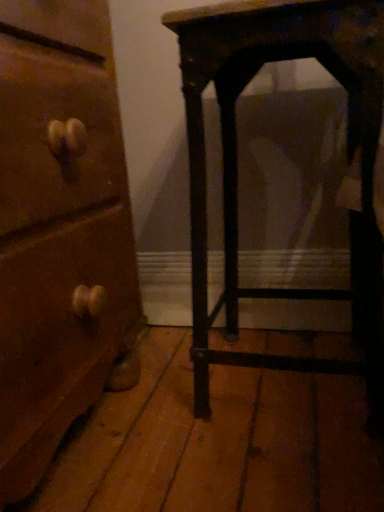
This screenshot has height=512, width=384. Describe the element at coordinates (60, 232) in the screenshot. I see `wooden chest of drawers at left` at that location.

In order to face wooden chest of drawers at left, should I rotate leftwards or rightwards?

To align with it, rotate left about 25.650°.

Locate an element on the screen. wooden chest of drawers at left is located at coordinates (60, 232).

Locate an element on the screen. The image size is (384, 512). dark wood table at right is located at coordinates (237, 160).

Measure the distance between point (276, 25) and camera.

Point (276, 25) and camera are 25.31 inches apart.

This screenshot has height=512, width=384. Describe the element at coordinates (237, 160) in the screenshot. I see `dark wood table at right` at that location.

You are a GUI agent. You are given a task and a screenshot of the screen. Output one action in this format:
    pyautogui.click(x=<x>, y=<y>)
    Task: Click on the wooden chest of drawers at left
    Image resolution: width=384 pixels, height=512 pixels.
    Given the screenshot: What is the action you would take?
    pyautogui.click(x=60, y=232)

Is wooden chest of drawers at left to the right of dark wood table at right from the viewer's perspective?

Incorrect, wooden chest of drawers at left is not on the right side of dark wood table at right.

Is wooden chest of drawers at left closer to the viewer compared to dark wood table at right?

Yes, wooden chest of drawers at left is closer to the camera.

Is point (49, 324) closer or farther from the camera than point (222, 118)?

Point (49, 324).

From the image's perspective, which is above, wooden chest of drawers at left or dark wood table at right?

dark wood table at right.

From a real-world perspective, is wooden chest of drawers at left located beneath dark wood table at right?

No, from a real-world perspective, wooden chest of drawers at left is not below dark wood table at right.

In terms of width, does wooden chest of drawers at left look wider or thinner when compared to dark wood table at right?

Clearly, wooden chest of drawers at left has more width compared to dark wood table at right.

Is wooden chest of drawers at left taller or shorter than dark wood table at right?

In the image, wooden chest of drawers at left appears to be taller than dark wood table at right.

Can you confirm if wooden chest of drawers at left is smaller than dark wood table at right?

No.

Would you say wooden chest of drawers at left is inside or outside dark wood table at right?

wooden chest of drawers at left is not inside dark wood table at right, it's outside.

Is wooden chest of drawers at left not close to dark wood table at right?

They are positioned close to each other.

Is wooden chest of drawers at left facing away from dark wood table at right?

No, wooden chest of drawers at left's orientation is not away from dark wood table at right.

Can you tell me how much wooden chest of drawers at left and dark wood table at right differ in facing direction?

The angular difference between wooden chest of drawers at left and dark wood table at right is 90.4 degrees.

You are a GUI agent. You are given a task and a screenshot of the screen. Output one action in this format:
    pyautogui.click(x=<x>, y=<y>)
    Task: Click on the furniture directly beneath the wooden chest of drawers at left (from a real-world perspective)
    This screenshot has height=512, width=384.
    Given the screenshot: What is the action you would take?
    pyautogui.click(x=237, y=160)

Which object is positioned more to the right, dark wood table at right or wooden chest of drawers at left?

dark wood table at right.

Is the depth of dark wood table at right greater than that of wooden chest of drawers at left?

Yes, dark wood table at right is further from the viewer.

Considering the points (369, 104) and (81, 28), which point is behind, point (369, 104) or point (81, 28)?

The point (81, 28) is farther from the camera.

From the image's perspective, is dark wood table at right positioned above or below wooden chest of drawers at left?

dark wood table at right is situated higher than wooden chest of drawers at left in the image.

From a real-world perspective, is dark wood table at right located higher than wooden chest of drawers at left?

No, from a real-world perspective, dark wood table at right is not above wooden chest of drawers at left.

In terms of width, does dark wood table at right look wider or thinner when compared to wooden chest of drawers at left?

Clearly, dark wood table at right has less width compared to wooden chest of drawers at left.

Does dark wood table at right have a lesser height compared to wooden chest of drawers at left?

Correct, dark wood table at right is not as tall as wooden chest of drawers at left.

Considering the sizes of objects dark wood table at right and wooden chest of drawers at left in the image provided, who is bigger, dark wood table at right or wooden chest of drawers at left?

wooden chest of drawers at left.

Is dark wood table at right completely or partially outside of wooden chest of drawers at left?

Yes, dark wood table at right is not within wooden chest of drawers at left.

Are dark wood table at right and wooden chest of drawers at left located far from each other?

No, dark wood table at right is not far away from wooden chest of drawers at left.

Is dark wood table at right facing away from wooden chest of drawers at left?

No, dark wood table at right is not facing the opposite direction of wooden chest of drawers at left.

How many degrees apart are the facing directions of dark wood table at right and wooden chest of drawers at left?

They differ by 90.4 degrees in their facing directions.

This screenshot has width=384, height=512. What are the coordinates of `chest of drawers on the left side of dark wood table at right` in the screenshot? It's located at (60, 232).

Locate an element on the screen. The width and height of the screenshot is (384, 512). the chest of drawers in front of the dark wood table at right is located at coordinates point(60,232).

The width and height of the screenshot is (384, 512). Identify the location of furniture on the right of the wooden chest of drawers at left. (237, 160).